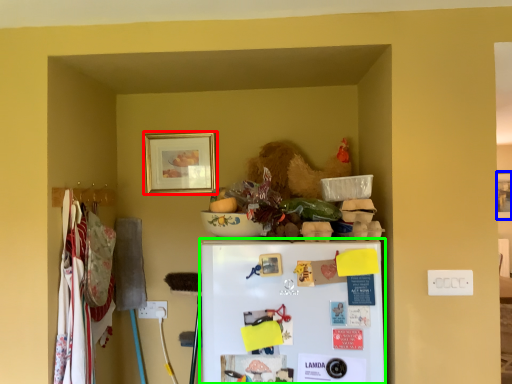
Question: Which object is positioned closest to picture frame (highlighted by a red box)? Select from picture frame (highlighted by a blue box) and refrigerator (highlighted by a green box).

Choices:
 (A) picture frame
 (B) refrigerator

Answer: (B)